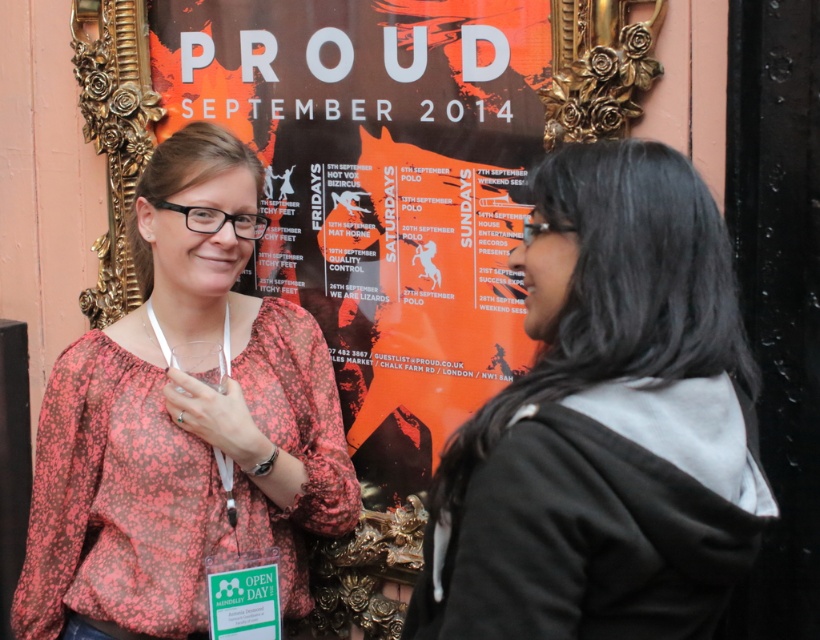
Question: Is black fabric jacket at center behind floral print blouse at center?

Choices:
 (A) yes
 (B) no

Answer: (B)

Question: Which of the following is the closest to the observer?

Choices:
 (A) (738, 371)
 (B) (254, 212)

Answer: (A)

Question: Which of the following is the closest to the observer?

Choices:
 (A) floral print blouse at center
 (B) black fabric jacket at center

Answer: (B)

Question: Does black fabric jacket at center appear under floral print blouse at center?

Choices:
 (A) no
 (B) yes

Answer: (A)

Question: Can you confirm if black fabric jacket at center is wider than floral print blouse at center?

Choices:
 (A) no
 (B) yes

Answer: (A)

Question: Among these points, which one is nearest to the camera?

Choices:
 (A) (690, 493)
 (B) (226, 444)

Answer: (A)